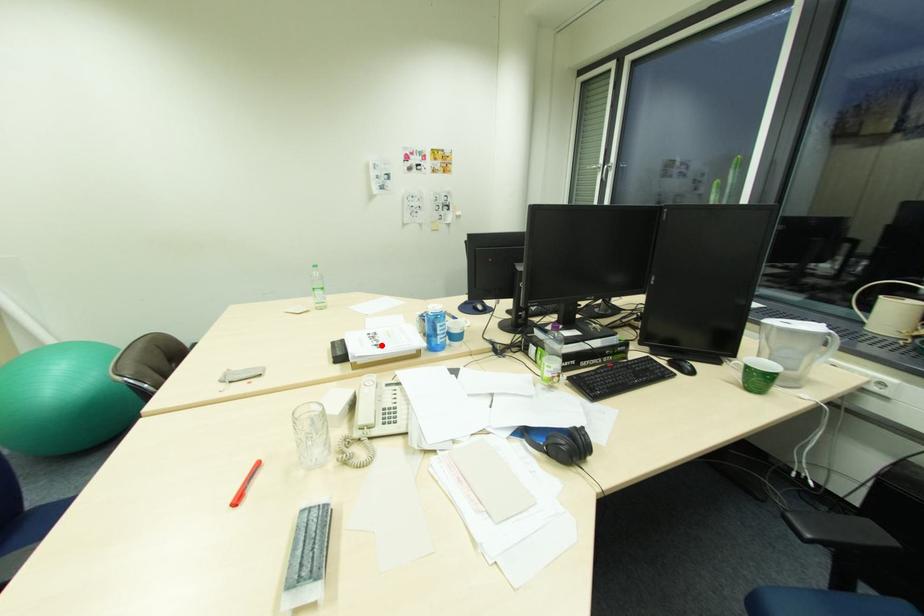
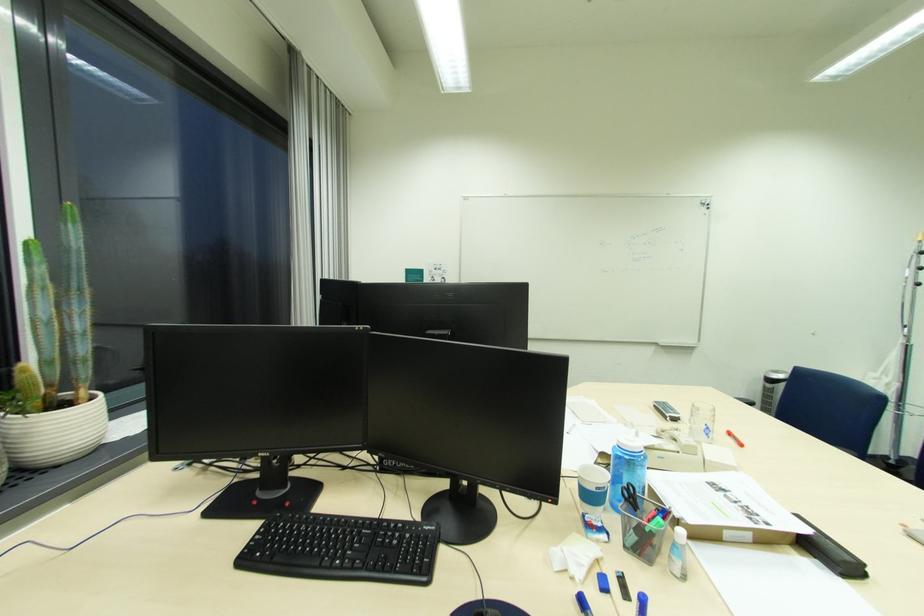
Question: A red point is marked in image1. In image2, is the corresponding 3D point closer to the camera or farther? Reply with the corresponding letter.

Choices:
 (A) The corresponding 3D point is closer.
 (B) The corresponding 3D point is farther.

Answer: (B)